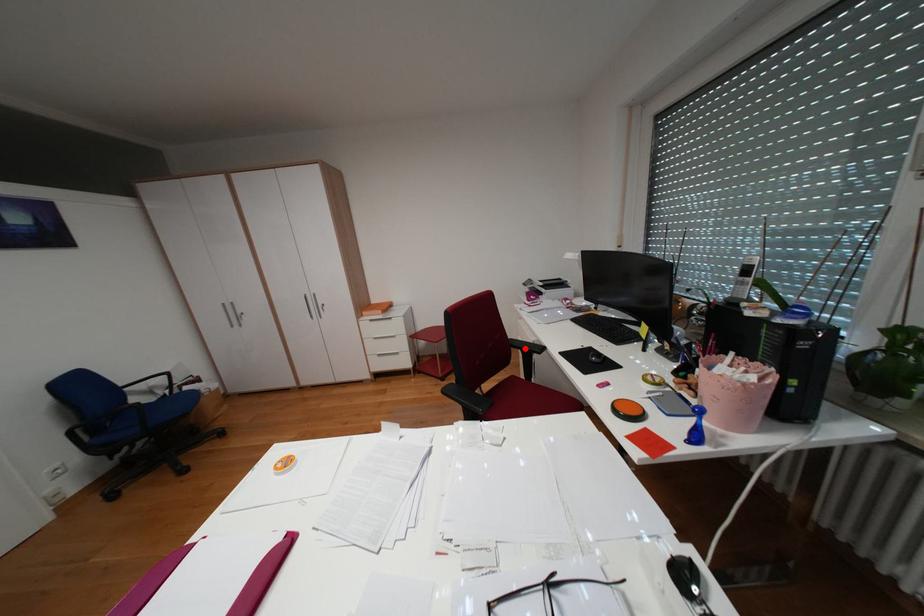
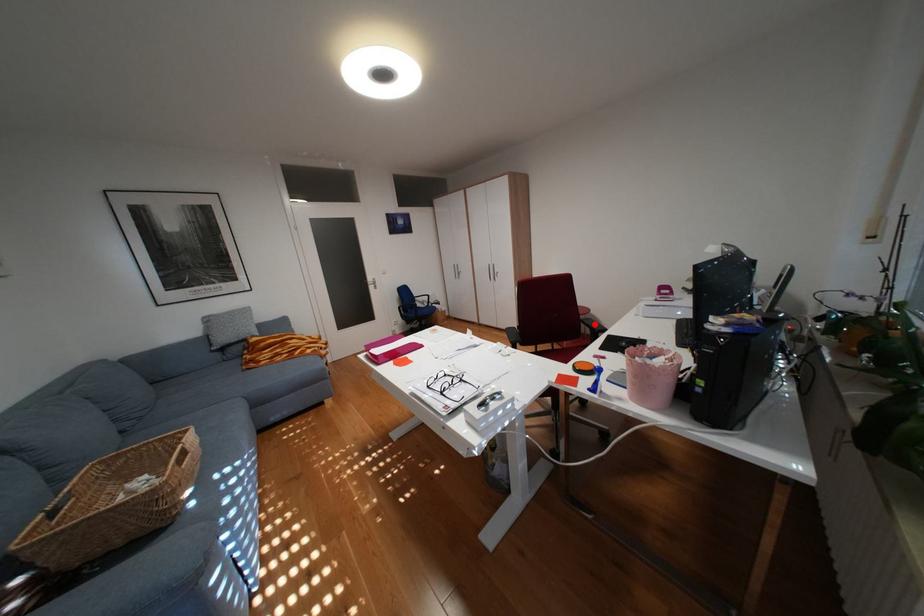
I am providing you with two images of the same scene from different viewpoints. A red point is marked on the first image and another point is marked on the second image. Is the red point in image1 aligned with the point shown in image2?

Yes